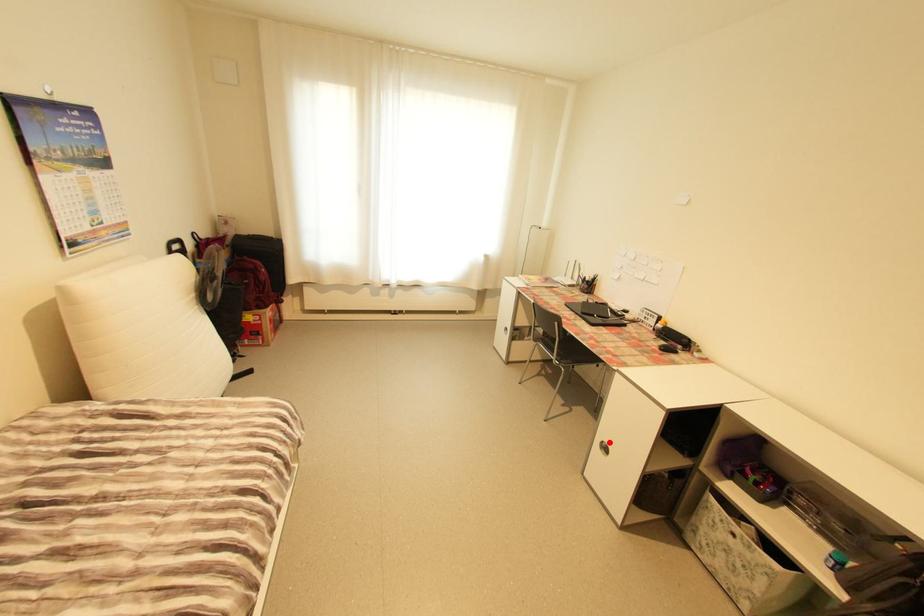
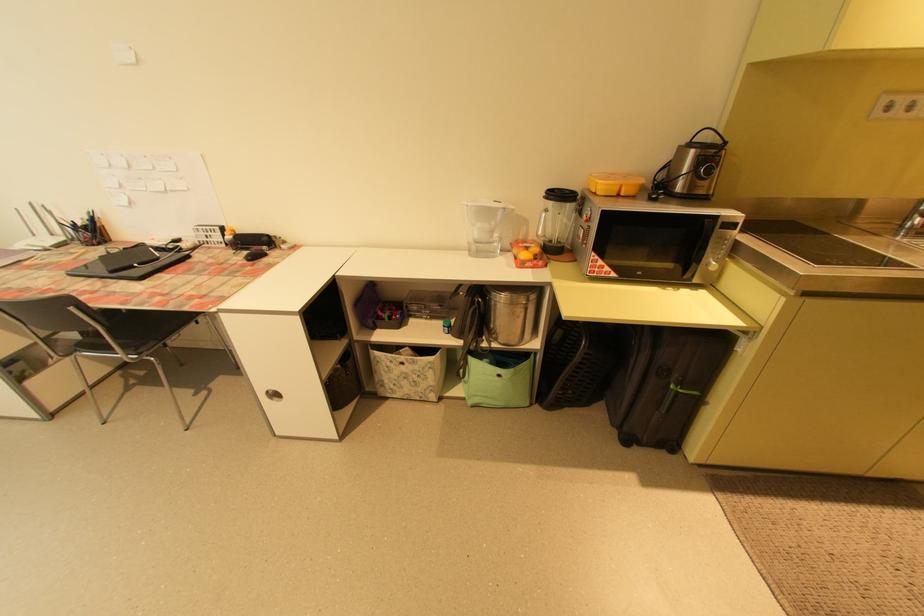
Question: I am providing you with two images of the same scene from different viewpoints. Given a red point in image1, look at the same physical point in image2. Is it:

Choices:
 (A) Closer to the viewpoint
 (B) Farther from the viewpoint

Answer: (B)